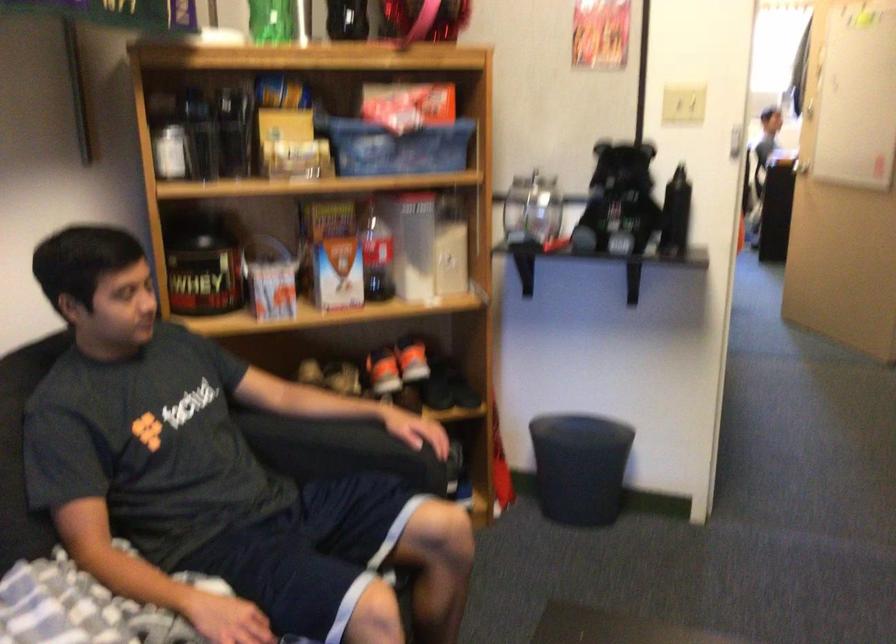
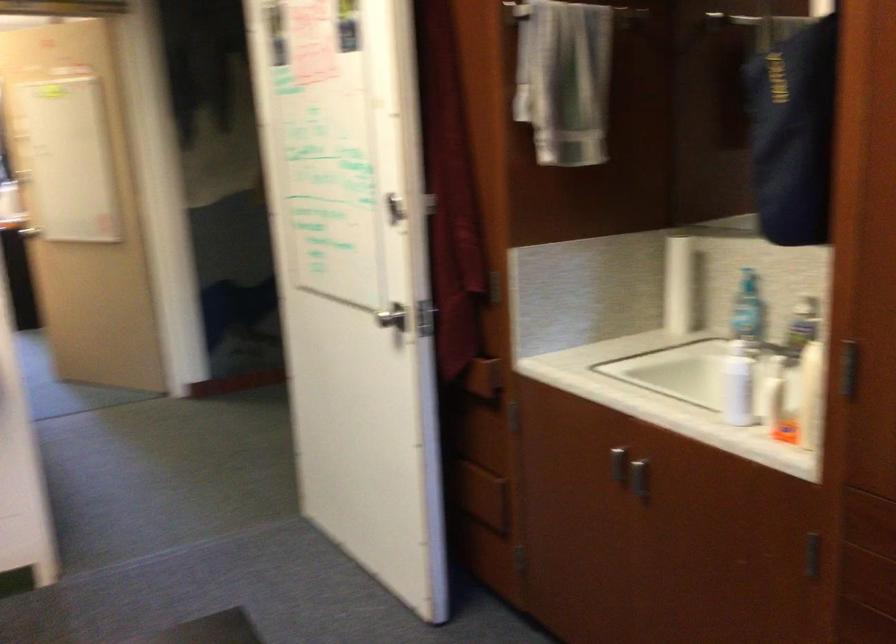
Question: The camera is either moving clockwise (left) or counter-clockwise (right) around the object. The first image is from the beginning of the video and the second image is from the end. Is the camera moving left or right when shooting the video?

Choices:
 (A) Left
 (B) Right

Answer: (A)